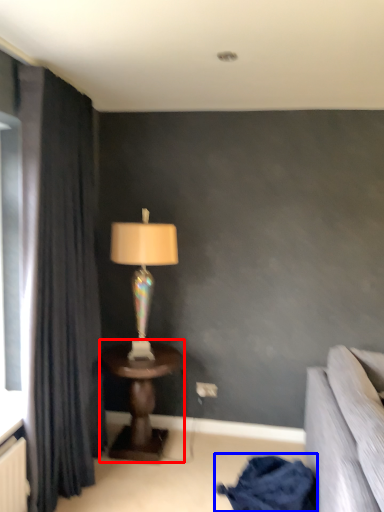
Question: Which point is further to the camera, table (highlighted by a red box) or blanket (highlighted by a blue box)?

Choices:
 (A) table
 (B) blanket

Answer: (A)